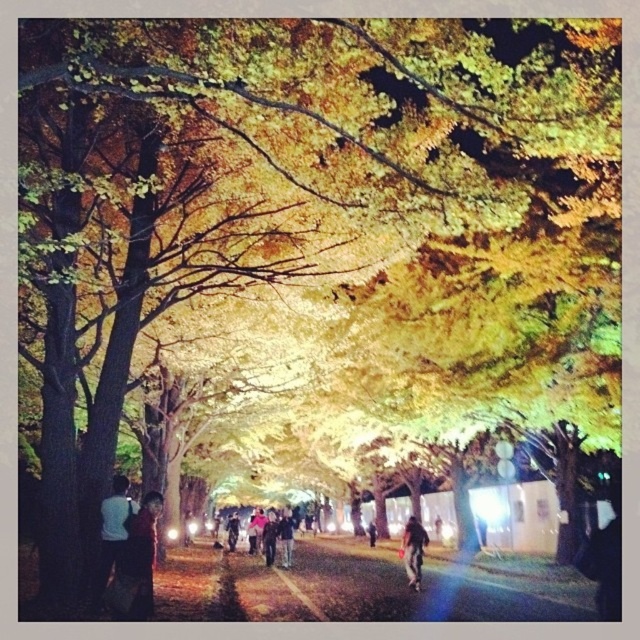
Who is lower down, shiny asphalt path at center or dark brown leather jacket at center?

dark brown leather jacket at center

Who is more distant from viewer, (580, 620) or (369, 529)?

Point (369, 529)

What are the coordinates of `shiny asphalt path at center` in the screenshot? It's located at click(435, 586).

Is white matte shirt at lower left bigger than dark gray fabric jacket at lower center?

Actually, white matte shirt at lower left might be smaller than dark gray fabric jacket at lower center.

Which of these two, white matte shirt at lower left or dark gray fabric jacket at lower center, stands taller?

dark gray fabric jacket at lower center

The width and height of the screenshot is (640, 640). Describe the element at coordinates (113, 532) in the screenshot. I see `white matte shirt at lower left` at that location.

The height and width of the screenshot is (640, 640). Find the location of `white matte shirt at lower left`. white matte shirt at lower left is located at coordinates tap(113, 532).

The height and width of the screenshot is (640, 640). Describe the element at coordinates (435, 586) in the screenshot. I see `shiny asphalt path at center` at that location.

Is point (259, 612) closer to camera compared to point (260, 522)?

Yes, point (259, 612) is closer to viewer.

Locate an element on the screen. Image resolution: width=640 pixels, height=640 pixels. shiny asphalt path at center is located at coordinates pyautogui.click(x=435, y=586).